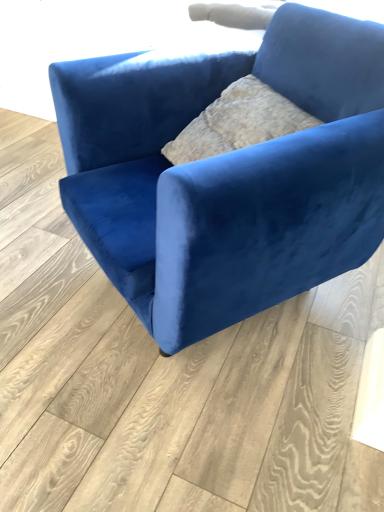
You are a GUI agent. You are given a task and a screenshot of the screen. Output one action in this format:
    pyautogui.click(x=<x>, y=<y>)
    Task: Click on the space that is in front of velvet blue armchair at center
    Image resolution: width=384 pixels, height=512 pixels.
    Given the screenshot: What is the action you would take?
    pyautogui.click(x=190, y=426)